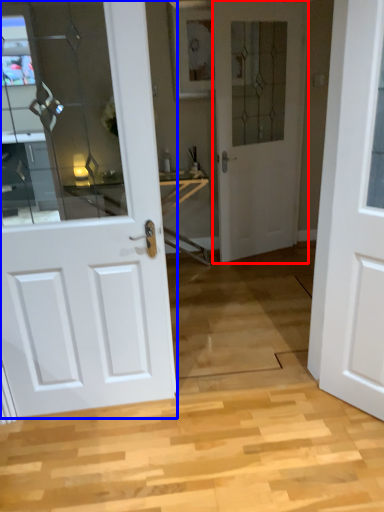
Question: Which of the following is the farthest to the observer, door (highlighted by a red box) or door (highlighted by a blue box)?

Choices:
 (A) door
 (B) door

Answer: (A)